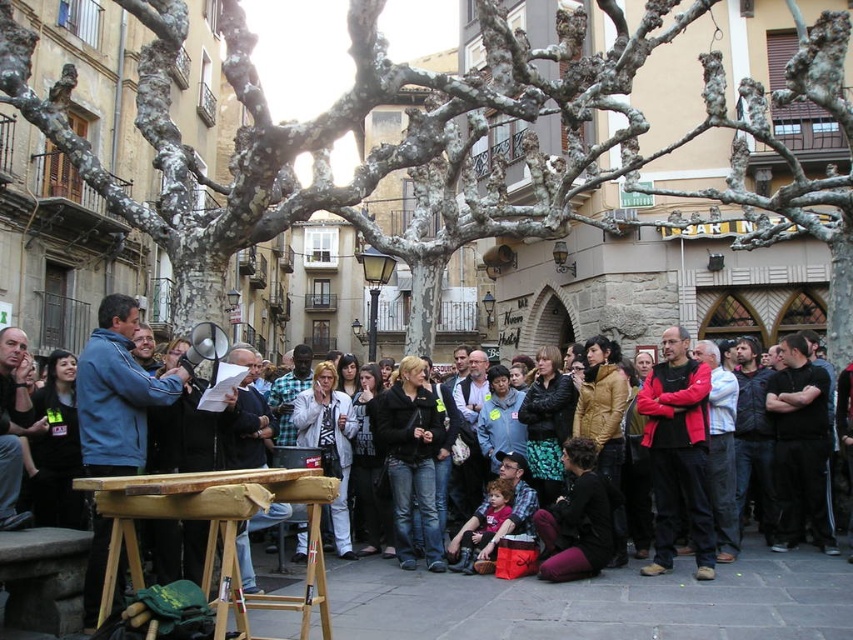
From the picture: You are standing in the town square and want to walk from point (265, 579) to point (90, 461). Based on their positions, will you be moving closer to or further away from the large tree with white bark?

Point (265, 579) is further to the viewer than point (90, 461). Therefore, moving from point (265, 579) to point (90, 461) means you are moving further away from the large tree with white bark.

Looking at this image, you are standing in the town square and want to take a photo of the matte black jacket at center without the gray bark tree at center blocking it. What should you do?

Move to a position where the gray bark tree at center is no longer between you and the matte black jacket at center, as the gray bark tree at center is larger and could obstruct the view.